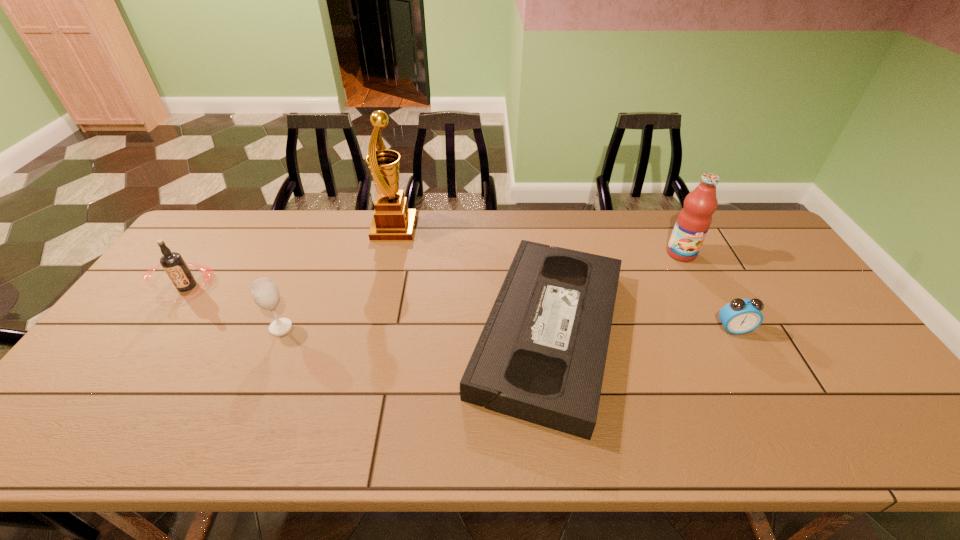
Identify the location of award. (392, 221).

The height and width of the screenshot is (540, 960). What are the coordinates of `the tallest object` in the screenshot? It's located at (392, 221).

Identify the location of the fifth shortest object. This screenshot has height=540, width=960. (693, 222).

Where is `the leftmost object`? the leftmost object is located at coordinates (172, 262).

In order to click on wineglass in this screenshot , I will do `click(264, 291)`.

Image resolution: width=960 pixels, height=540 pixels. What are the coordinates of `alarm clock` in the screenshot? It's located at (740, 316).

Identify the location of the fourth object from left to right. (541, 355).

Find the location of `the shortest object`. the shortest object is located at coordinates (541, 355).

Identify the location of vacant space located 0.050m on the front-facing side of the fourth object from right to left. This screenshot has height=540, width=960. (429, 228).

Find the location of a particular element. vacant area located on the front label of the fifth shortest object is located at coordinates (714, 318).